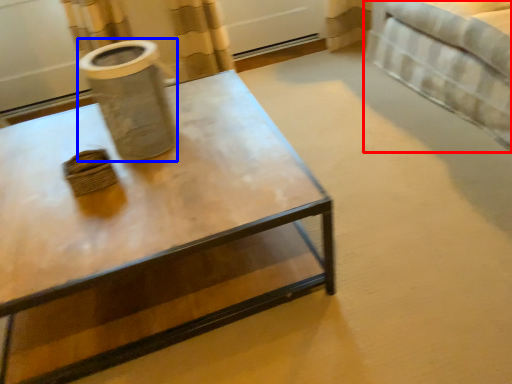
Question: Among these objects, which one is nearest to the camera, bed (highlighted by a red box) or vase (highlighted by a blue box)?

Choices:
 (A) bed
 (B) vase

Answer: (B)